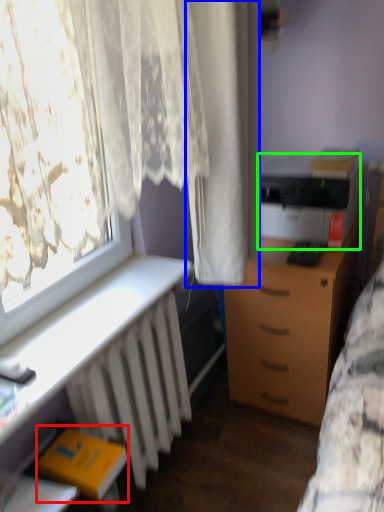
Question: Estimate the real-world distances between objects in this image. Which object is farther from book (highlighted by a red box), curtain (highlighted by a blue box) or printer (highlighted by a green box)?

Choices:
 (A) curtain
 (B) printer

Answer: (B)